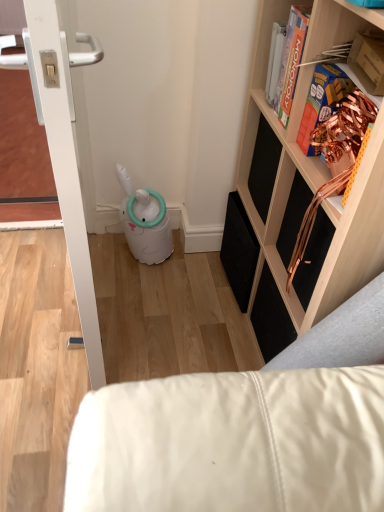
At what (x,y) coordinates should I click in order to perform the action: click on vacant space to the right of white glossy door at left. Please return your answer as a coordinate pair (x, y). Looking at the image, I should click on (169, 307).